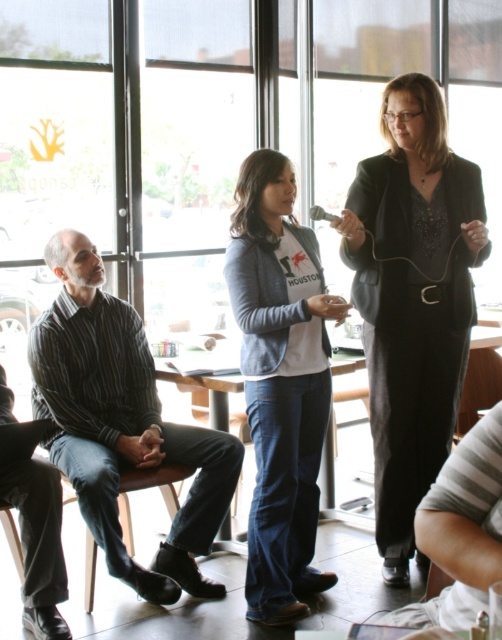
Question: Which of the following is the closest to the observer?

Choices:
 (A) black satin blazer at center
 (B) striped cotton shirt at left

Answer: (A)

Question: From the image, what is the correct spatial relationship of striped cotton shirt at left in relation to denim jeans at center?

Choices:
 (A) above
 (B) below

Answer: (B)

Question: Is black satin blazer at center smaller than striped cotton shirt at left?

Choices:
 (A) yes
 (B) no

Answer: (A)

Question: Can you confirm if black satin blazer at center is positioned above striped cotton shirt at left?

Choices:
 (A) no
 (B) yes

Answer: (B)

Question: Which point is closer to the camera?

Choices:
 (A) black satin blazer at center
 (B) denim jeans at center

Answer: (B)

Question: Which point appears farthest from the camera in this image?

Choices:
 (A) (396, 208)
 (B) (245, 376)
 (C) (35, 416)

Answer: (C)